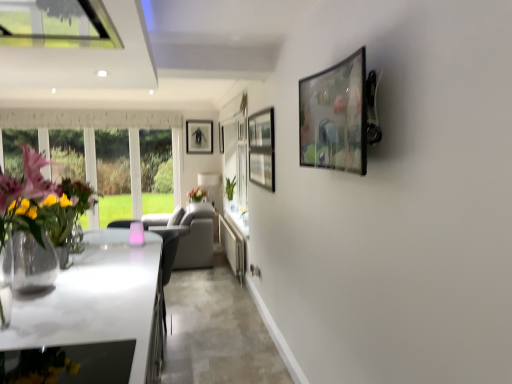
Question: Does white fabric lampshade at center have a lesser height compared to metallic glossy picture frame at upper right, arranged as the 1th picture frame when viewed from the right?

Choices:
 (A) yes
 (B) no

Answer: (B)

Question: Does white fabric lampshade at center appear on the left side of metallic glossy picture frame at upper right, the first picture frame positioned from the front?

Choices:
 (A) no
 (B) yes

Answer: (B)

Question: Is white fabric lampshade at center smaller than metallic glossy picture frame at upper right, which is counted as the third picture frame, starting from the back?

Choices:
 (A) yes
 (B) no

Answer: (B)

Question: Is white fabric lampshade at center taller than metallic glossy picture frame at upper right, the third picture frame viewed from the left?

Choices:
 (A) yes
 (B) no

Answer: (A)

Question: Is white fabric lampshade at center looking in the opposite direction of metallic glossy picture frame at upper right, the first picture frame positioned from the front?

Choices:
 (A) no
 (B) yes

Answer: (A)

Question: Is white fabric lampshade at center positioned before metallic glossy picture frame at upper right, the third picture frame viewed from the left?

Choices:
 (A) yes
 (B) no

Answer: (B)

Question: Does metallic glossy picture frame at upper right, the third picture frame viewed from the left, have a greater width compared to white glossy countertop at lower left?

Choices:
 (A) no
 (B) yes

Answer: (A)

Question: Is metallic glossy picture frame at upper right, the first picture frame positioned from the front, behind white glossy countertop at lower left?

Choices:
 (A) no
 (B) yes

Answer: (A)

Question: Is metallic glossy picture frame at upper right, the first picture frame positioned from the front, taller than white glossy countertop at lower left?

Choices:
 (A) no
 (B) yes

Answer: (B)

Question: From the image's perspective, is metallic glossy picture frame at upper right, arranged as the 1th picture frame when viewed from the right, located beneath white glossy countertop at lower left?

Choices:
 (A) no
 (B) yes

Answer: (A)

Question: Does metallic glossy picture frame at upper right, which is counted as the third picture frame, starting from the back, have a lesser width compared to white glossy countertop at lower left?

Choices:
 (A) no
 (B) yes

Answer: (B)

Question: From a real-world perspective, is metallic glossy picture frame at upper right, the third picture frame viewed from the left, under white glossy countertop at lower left?

Choices:
 (A) no
 (B) yes

Answer: (A)

Question: Is matte black picture frame at center, the first picture frame from the left, positioned beyond the bounds of white glossy counter top at center?

Choices:
 (A) no
 (B) yes

Answer: (B)